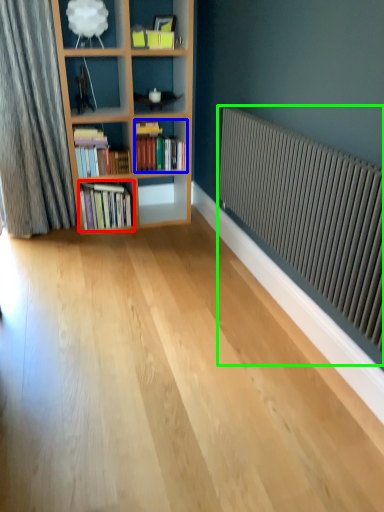
Question: Considering the real-world distances, which object is farthest from book (highlighted by a red box)? book (highlighted by a blue box) or radiator (highlighted by a green box)?

Choices:
 (A) book
 (B) radiator

Answer: (B)